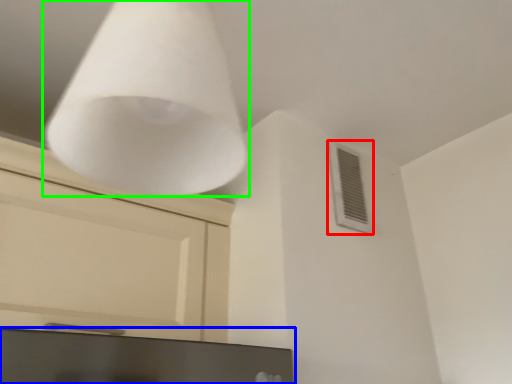
Question: Which object is the farthest from air conditioning (highlighted by a red box)? Choose among these: computer monitor (highlighted by a blue box) or lamp (highlighted by a green box).

Choices:
 (A) computer monitor
 (B) lamp

Answer: (B)